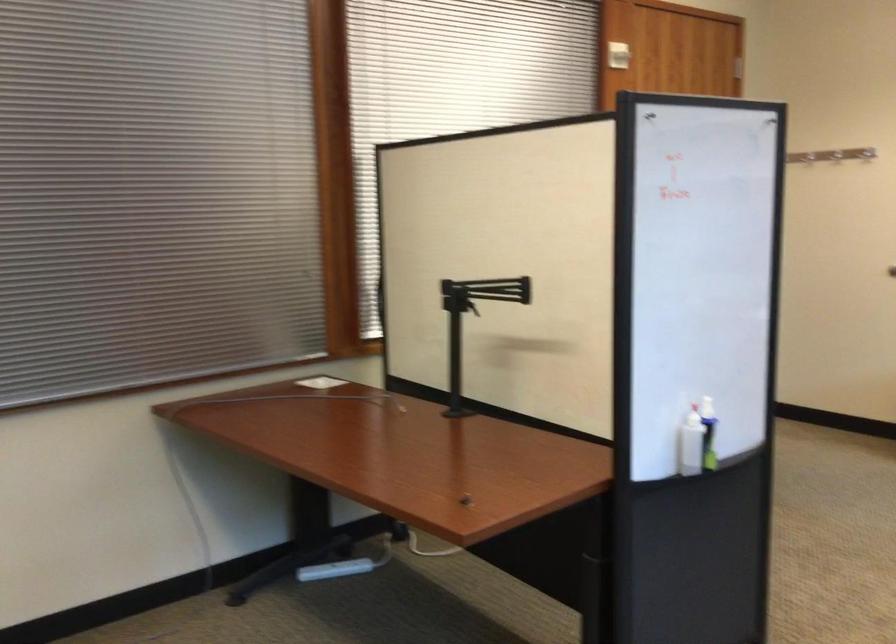
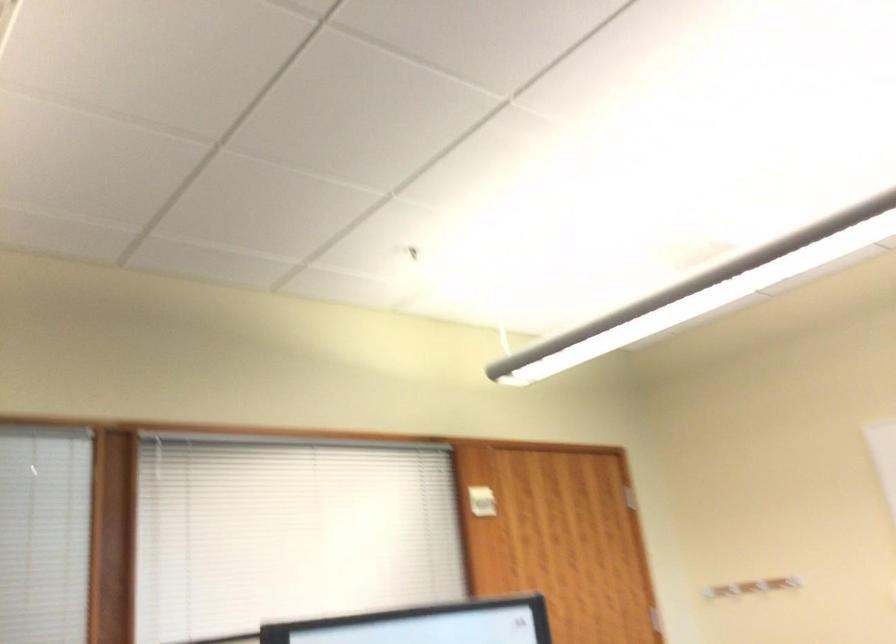
Question: Based on the continuous images, in which direction is the camera rotating? Reply with the corresponding letter.

Choices:
 (A) Left
 (B) Right
 (C) Up
 (D) Down

Answer: (C)